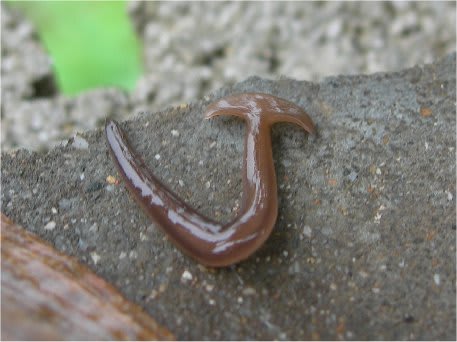
This screenshot has width=457, height=342. Find the location of `wood type surface`. wood type surface is located at coordinates coord(71,298).